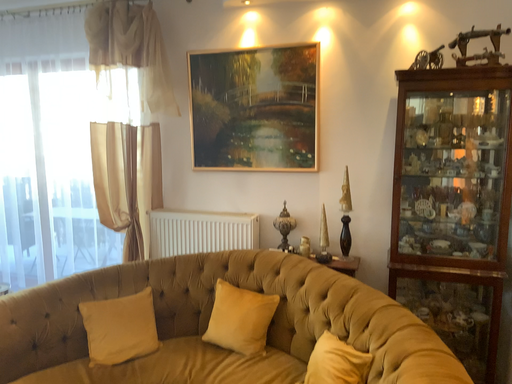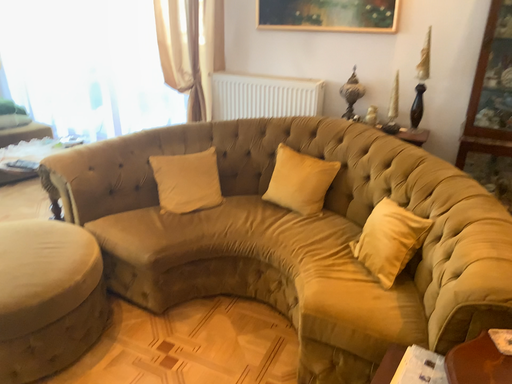
Question: Which way did the camera rotate in the video?

Choices:
 (A) rotated upward
 (B) rotated downward

Answer: (B)